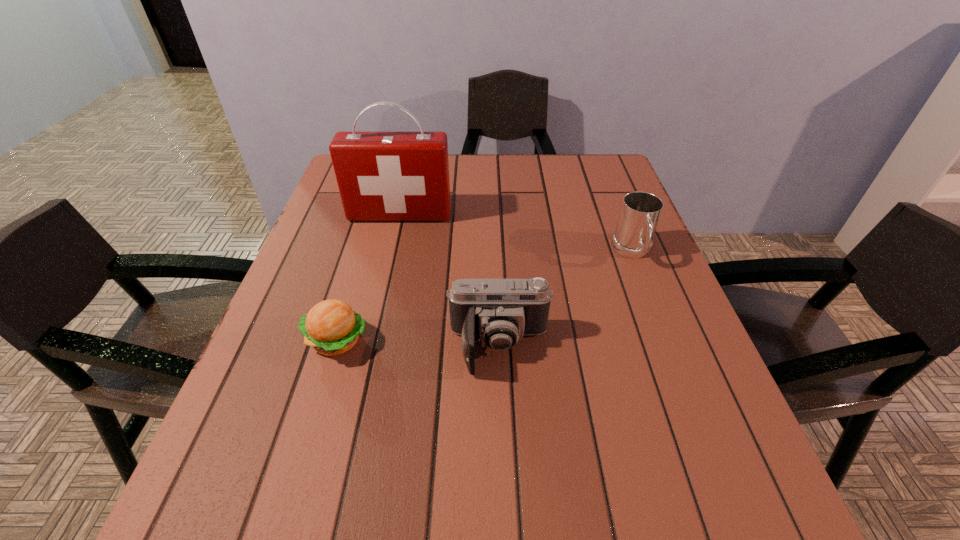
The width and height of the screenshot is (960, 540). I want to click on vacant space that's between the rightmost object and the first-aid kit, so pos(516,233).

You are a GUI agent. You are given a task and a screenshot of the screen. Output one action in this format:
    pyautogui.click(x=<x>, y=<y>)
    Task: Click on the vacant region between the shortest object and the tallest object
    This screenshot has height=540, width=960.
    Given the screenshot: What is the action you would take?
    pyautogui.click(x=369, y=278)

Locate an element on the screen. empty space between the camera and the mug is located at coordinates (566, 300).

At what (x,y) coordinates should I click in order to perform the action: click on object that ranks as the second closest to the farthest object. Please return your answer as a coordinate pair (x, y). The image size is (960, 540). Looking at the image, I should click on (498, 312).

The height and width of the screenshot is (540, 960). Identify the location of object that is the third closest to the farthest object. (640, 211).